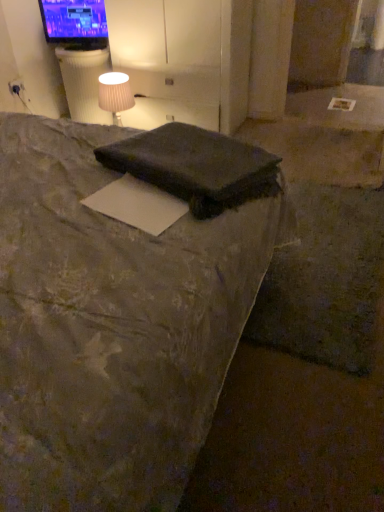
Identify the location of vacant space situated above white matte paper at center (from a real-world perspective). (139, 200).